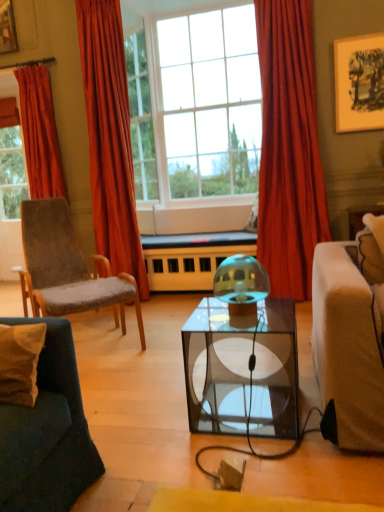
Question: From a real-world perspective, does clear glass window at upper center, which is counted as the 1th window, starting from the left, stand above velvet grey chair at left?

Choices:
 (A) no
 (B) yes

Answer: (B)

Question: Considering the relative sizes of clear glass window at upper center, which is counted as the 1th window, starting from the left, and velvet grey chair at left in the image provided, is clear glass window at upper center, which is counted as the 1th window, starting from the left, wider than velvet grey chair at left?

Choices:
 (A) yes
 (B) no

Answer: (B)

Question: Is clear glass window at upper center, placed as the 2th window when sorted from right to left, at the right side of velvet grey chair at left?

Choices:
 (A) yes
 (B) no

Answer: (A)

Question: Does clear glass window at upper center, which is counted as the 1th window, starting from the left, appear on the left side of velvet grey chair at left?

Choices:
 (A) no
 (B) yes

Answer: (A)

Question: Is clear glass window at upper center, which is counted as the 1th window, starting from the left, not near velvet grey chair at left?

Choices:
 (A) yes
 (B) no

Answer: (A)

Question: Is clear glass window at upper center, placed as the 2th window when sorted from right to left, bigger or smaller than velvet grey chair at left?

Choices:
 (A) big
 (B) small

Answer: (B)

Question: Considering the positions of point (145, 71) and point (69, 268), is point (145, 71) closer or farther from the camera than point (69, 268)?

Choices:
 (A) closer
 (B) farther

Answer: (B)

Question: From the image's perspective, is clear glass window at upper center, which is counted as the 1th window, starting from the left, positioned above or below velvet grey chair at left?

Choices:
 (A) above
 (B) below

Answer: (A)

Question: Is clear glass window at upper center, placed as the 2th window when sorted from right to left, spatially inside velvet grey chair at left, or outside of it?

Choices:
 (A) inside
 (B) outside

Answer: (B)

Question: In the image, is velvet orange curtain at left, which ranks as the 2th curtain in right-to-left order, positioned in front of or behind red velvet curtain at center, which ranks as the 1th curtain in right-to-left order?

Choices:
 (A) front
 (B) behind

Answer: (B)

Question: From their relative heights in the image, would you say velvet orange curtain at left, which ranks as the 2th curtain in right-to-left order, is taller or shorter than red velvet curtain at center, which ranks as the 1th curtain in right-to-left order?

Choices:
 (A) tall
 (B) short

Answer: (A)

Question: Considering the positions of velvet orange curtain at left, which ranks as the 2th curtain in right-to-left order, and red velvet curtain at center, the third curtain in the left-to-right sequence, in the image, is velvet orange curtain at left, which ranks as the 2th curtain in right-to-left order, bigger or smaller than red velvet curtain at center, the third curtain in the left-to-right sequence,?

Choices:
 (A) small
 (B) big

Answer: (B)

Question: From the image's perspective, is velvet orange curtain at left, the second curtain viewed from the left, above or below red velvet curtain at center, which ranks as the 1th curtain in right-to-left order?

Choices:
 (A) below
 (B) above

Answer: (B)

Question: In terms of size, does red velvet curtain at left, positioned as the first curtain in left-to-right order, appear bigger or smaller than velvet orange curtain at left, the second curtain viewed from the left?

Choices:
 (A) small
 (B) big

Answer: (A)

Question: From a real-world perspective, relative to velvet orange curtain at left, which ranks as the 2th curtain in right-to-left order, is red velvet curtain at left, the 3th curtain when ordered from right to left, vertically above or below?

Choices:
 (A) below
 (B) above

Answer: (B)